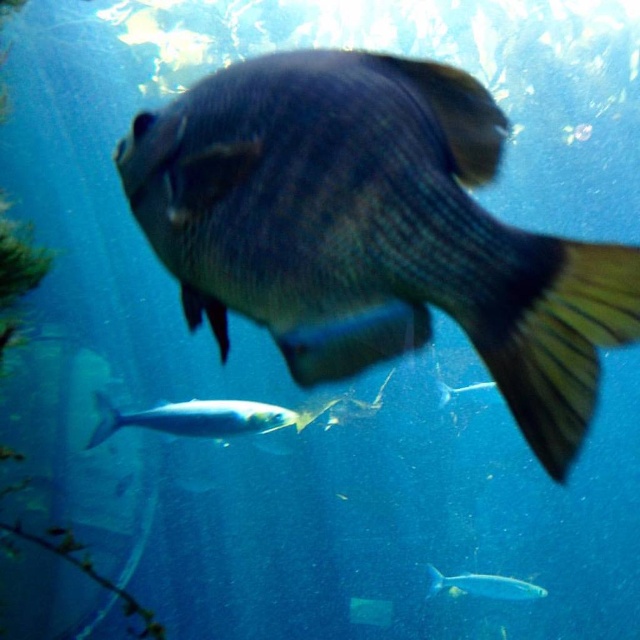
You are a marine biologist observing an underwater scene in an aquarium. You notice a point at coordinates point (348,83). If your camera is positioned at a standard distance, can you estimate how far the point is from your camera?

The point (348,83) is 27.18 inches away from the camera, so the distance is 27.18 inches.

You are a marine biologist observing the aquarium. You notice two shiny silver fish. One is at the lower center and the other is at the center. From the perspective of the shiny silver fish at center, which direction is the shiny silver fish at lower center located?

The shiny silver fish at lower center is to the left of the shiny silver fish at center, so from the perspective of the shiny silver fish at center, the shiny silver fish at lower center is located to its left side.

You are an underwater photographer aiming to capture a clear shot of the shiny blue fish at center. Based on its position, which direction should you adjust your camera to focus on it?

The shiny blue fish at center is located at point coordinates, so you should adjust your camera towards the center of the frame to focus on it.